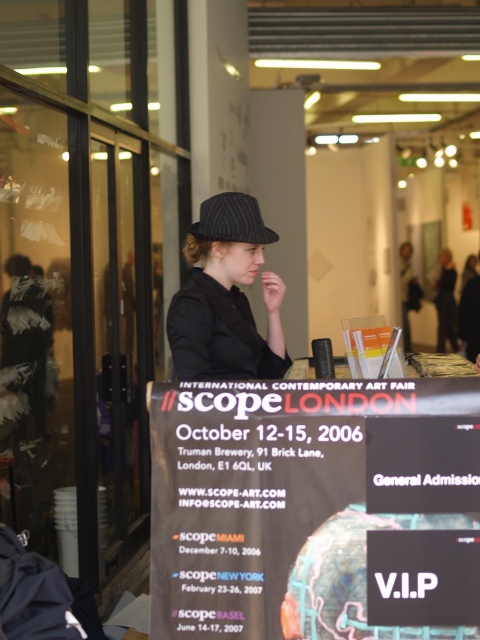
Question: Which of the following is the closest to the observer?

Choices:
 (A) dark blue pinstripe baseball hat at center
 (B) matte black hat at center

Answer: (B)

Question: Which object is farther from the camera taking this photo?

Choices:
 (A) dark blue pinstripe baseball hat at center
 (B) matte black hat at center

Answer: (A)

Question: Can you confirm if matte black hat at center is positioned above dark blue pinstripe baseball hat at center?

Choices:
 (A) yes
 (B) no

Answer: (B)

Question: Does matte black hat at center have a larger size compared to dark blue pinstripe baseball hat at center?

Choices:
 (A) no
 (B) yes

Answer: (B)

Question: Does matte black hat at center lie in front of dark blue pinstripe baseball hat at center?

Choices:
 (A) yes
 (B) no

Answer: (A)

Question: Among these objects, which one is nearest to the camera?

Choices:
 (A) matte black hat at center
 (B) dark blue pinstripe baseball hat at center

Answer: (A)